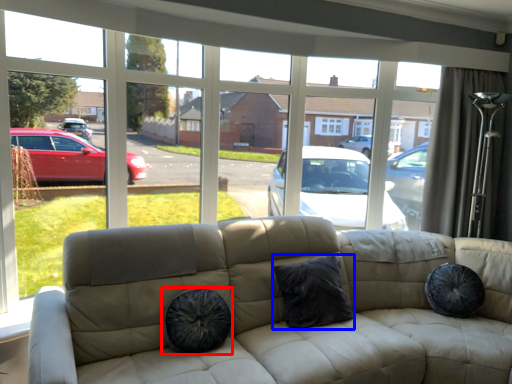
Question: Which of the following is the closest to the observer, dog bed (highlighted by a red box) or pillow (highlighted by a blue box)?

Choices:
 (A) dog bed
 (B) pillow

Answer: (A)